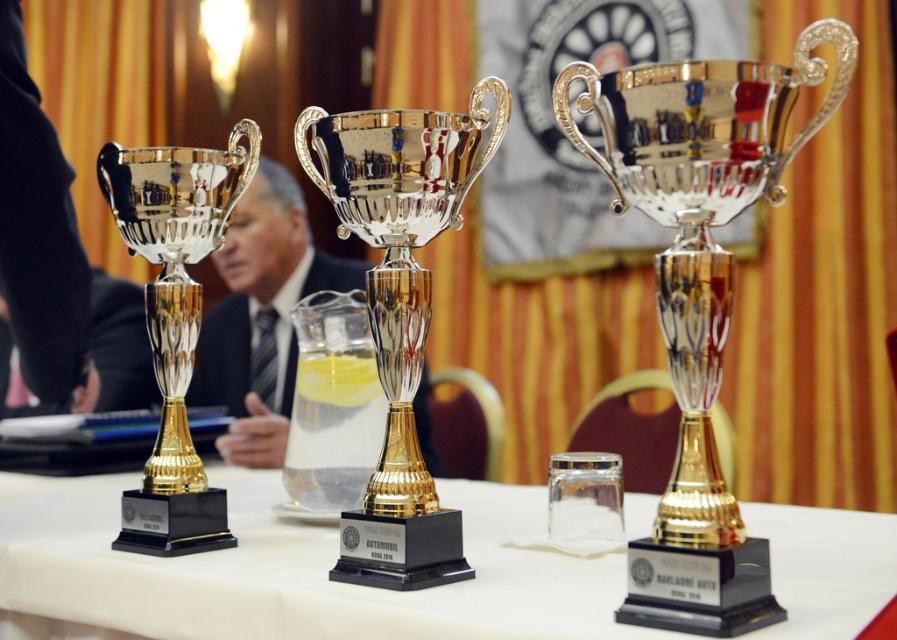
You are organizing a display table for an event and have both the metallic trophies at center and the polished silver trophy at center. If you want to place them side by side, which trophy should you place first to ensure they fit within the table space?

The polished silver trophy at center should be placed first since it has a smaller width compared to the metallic trophies at center, allowing more space for the wider trophy afterward.